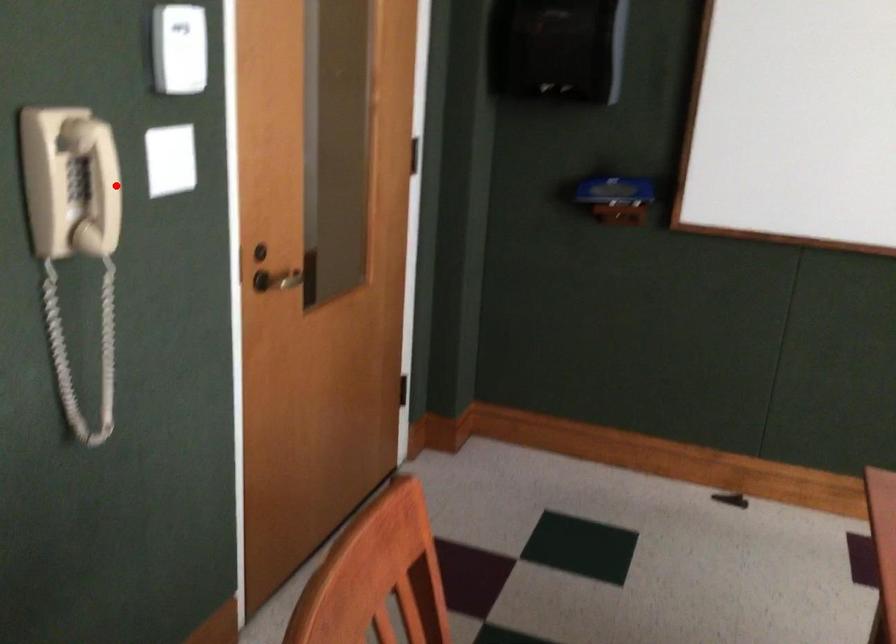
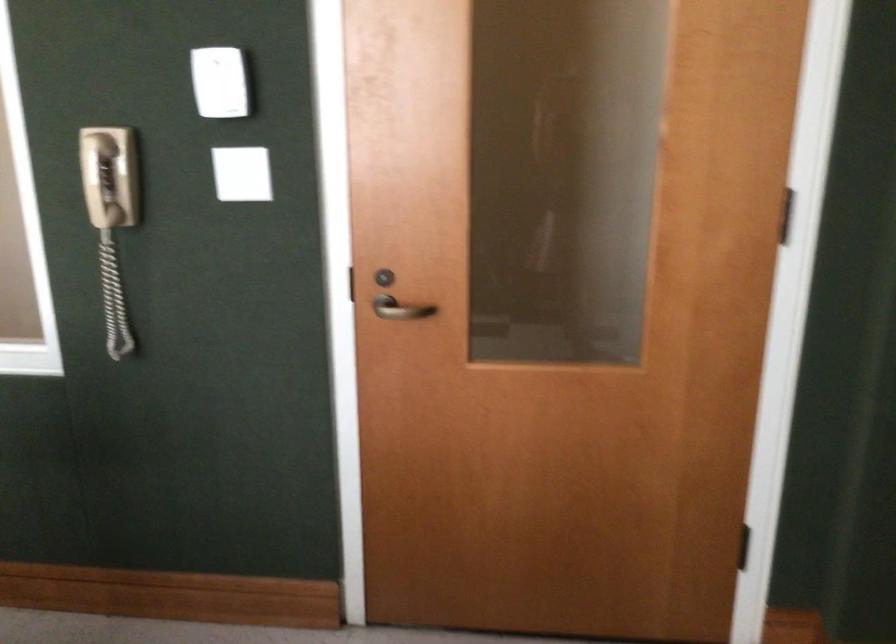
Where in the second image is the point corresponding to the highlighted location from the first image?

(99, 180)